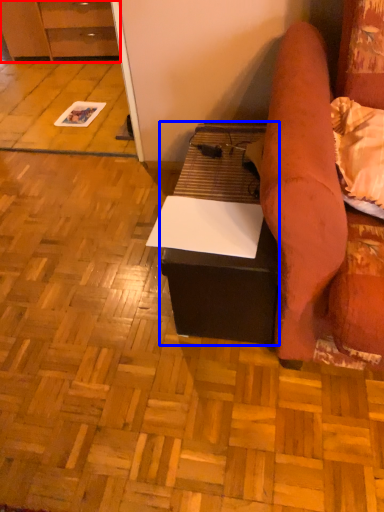
Question: Which object is closer to the camera taking this photo, cabinetry (highlighted by a red box) or table (highlighted by a blue box)?

Choices:
 (A) cabinetry
 (B) table

Answer: (B)